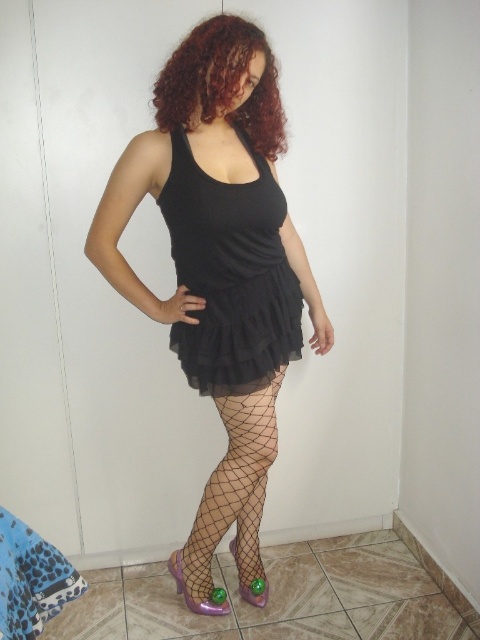
Question: Which point is closer to the camera?

Choices:
 (A) (252, 580)
 (B) (183, 593)

Answer: (B)

Question: Which point is closer to the camera?

Choices:
 (A) purple fishnet shoe at lower center
 (B) curly red hair at upper center
 (C) matte black dress at center

Answer: (B)

Question: Does fishnet tights at center appear under purple fishnet shoe at lower center?

Choices:
 (A) no
 (B) yes

Answer: (A)

Question: Where is curly red hair at upper center located in relation to shiny purple shoe at lower center in the image?

Choices:
 (A) left
 (B) right

Answer: (B)

Question: Is matte black dress at center smaller than curly red hair at upper center?

Choices:
 (A) no
 (B) yes

Answer: (A)

Question: Which is nearer to the fishnet tights at center?

Choices:
 (A) shiny purple shoe at lower center
 (B) black sheer dress at center

Answer: (A)